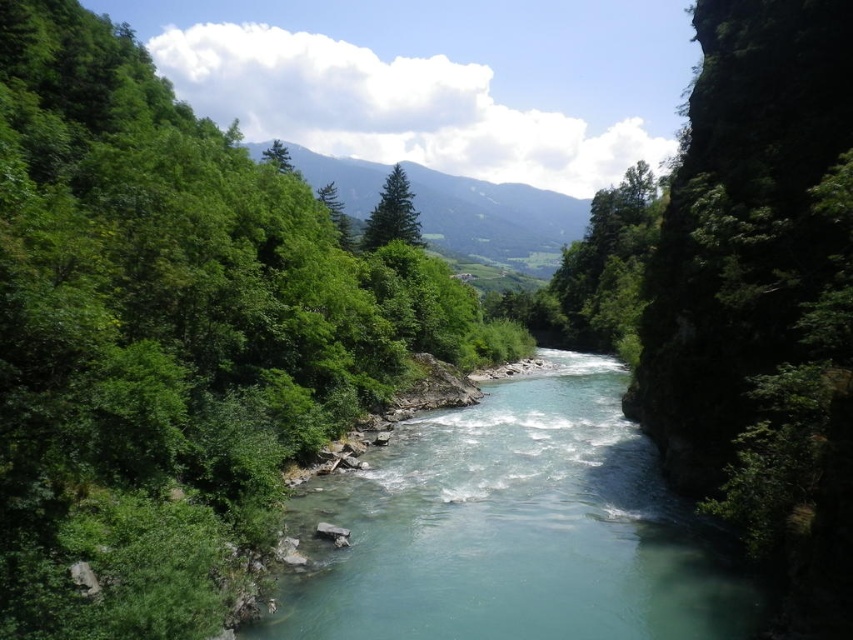
Question: Is green leafy tree at center left above green matte tree at center?

Choices:
 (A) no
 (B) yes

Answer: (A)

Question: Which object is farther from the camera taking this photo?

Choices:
 (A) green matte tree at upper center
 (B) green forested mountain at center

Answer: (B)

Question: Can you confirm if green forested mountain at center is bigger than green matte tree at upper center?

Choices:
 (A) no
 (B) yes

Answer: (B)

Question: Can you confirm if green matte tree at center is bigger than green matte tree at upper center?

Choices:
 (A) yes
 (B) no

Answer: (B)

Question: Among these points, which one is nearest to the camera?

Choices:
 (A) (508, 241)
 (B) (280, 144)
 (C) (128, 362)
 (D) (419, 243)

Answer: (C)

Question: Which object is farther from the camera taking this photo?

Choices:
 (A) green glossy tree at center
 (B) clear water at center
 (C) green leafy tree at center left
 (D) green matte tree at center

Answer: (A)